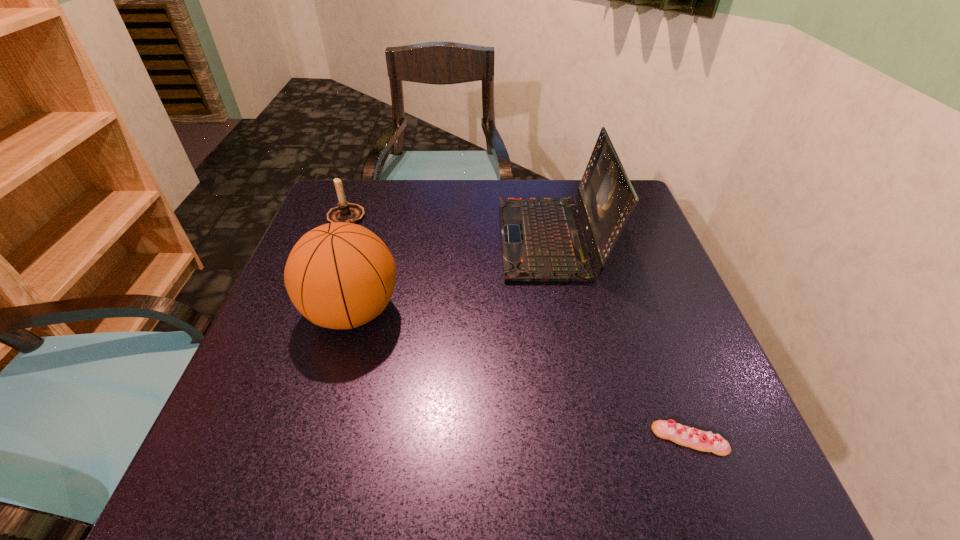
Where is `free space located on the back of the shortest object`? Image resolution: width=960 pixels, height=540 pixels. free space located on the back of the shortest object is located at coordinates (649, 330).

In order to click on laptop computer that is positioned at the far edge in this screenshot , I will do `click(542, 238)`.

Find the location of a particular element. The height and width of the screenshot is (540, 960). candle holder that is at the far edge is located at coordinates (347, 212).

Where is `object located in the near edge section of the desktop`? This screenshot has width=960, height=540. object located in the near edge section of the desktop is located at coordinates click(x=680, y=434).

Where is `basketball located in the left edge section of the desktop`? The width and height of the screenshot is (960, 540). basketball located in the left edge section of the desktop is located at coordinates (341, 275).

Locate an element on the screen. The width and height of the screenshot is (960, 540). candle holder that is at the left edge is located at coordinates (347, 212).

Where is `laptop computer positioned at the right edge`? laptop computer positioned at the right edge is located at coordinates (542, 238).

At what (x,y) coordinates should I click in order to perform the action: click on eclair at the right edge. Please return your answer as a coordinate pair (x, y). Looking at the image, I should click on (680, 434).

Image resolution: width=960 pixels, height=540 pixels. I want to click on object that is positioned at the far left corner, so point(347,212).

Identify the location of object that is at the far right corner. (542, 238).